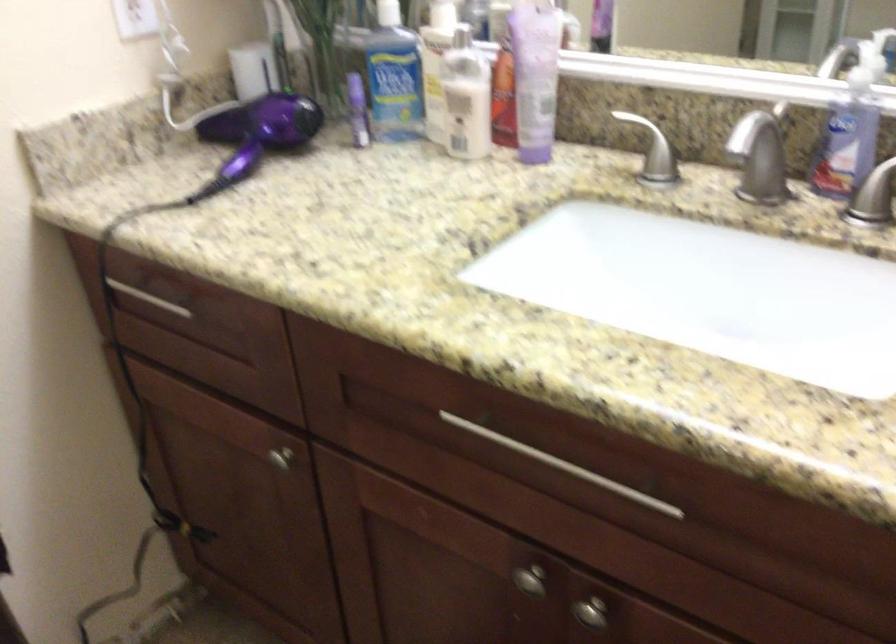
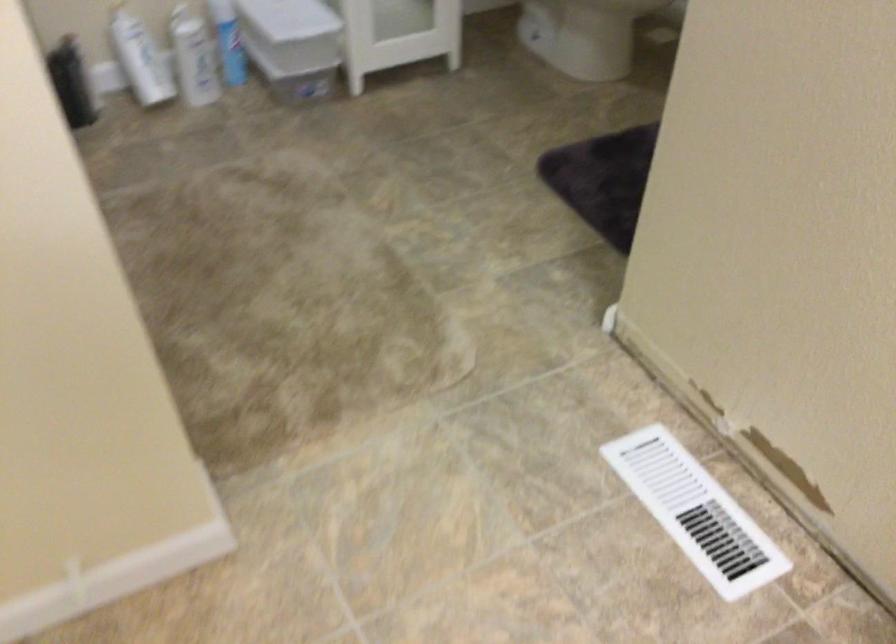
The first image is from the beginning of the video and the second image is from the end. How did the camera likely rotate when shooting the video?

The camera's rotation is toward left-down.